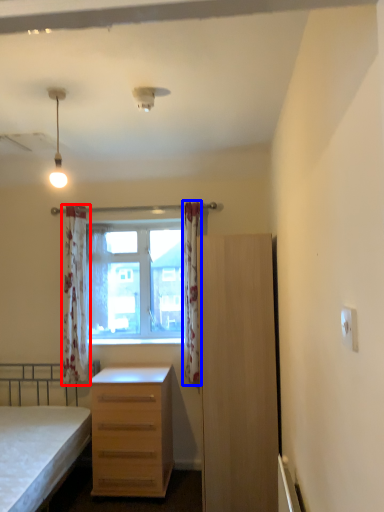
Question: Among these objects, which one is farthest to the camera, curtain (highlighted by a red box) or curtain (highlighted by a blue box)?

Choices:
 (A) curtain
 (B) curtain

Answer: (A)